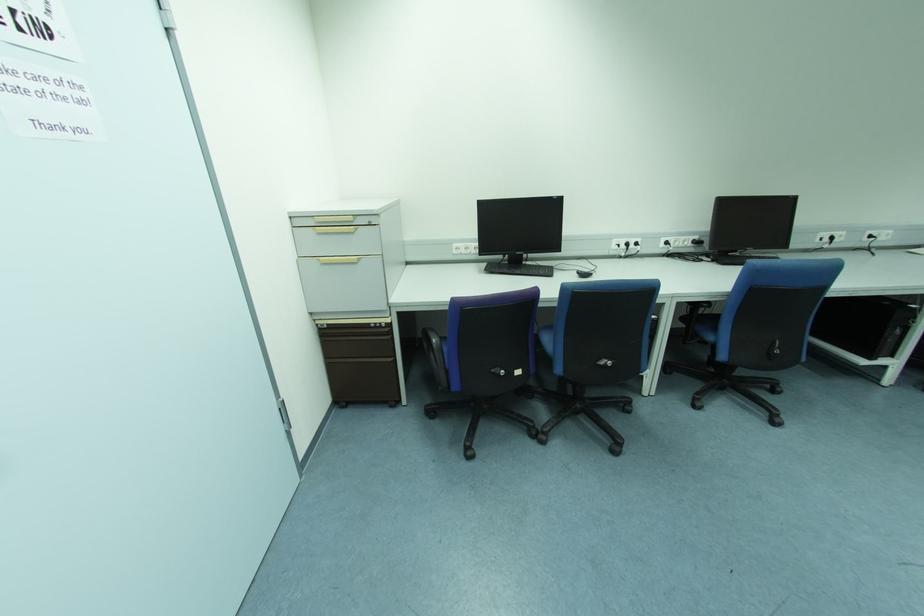
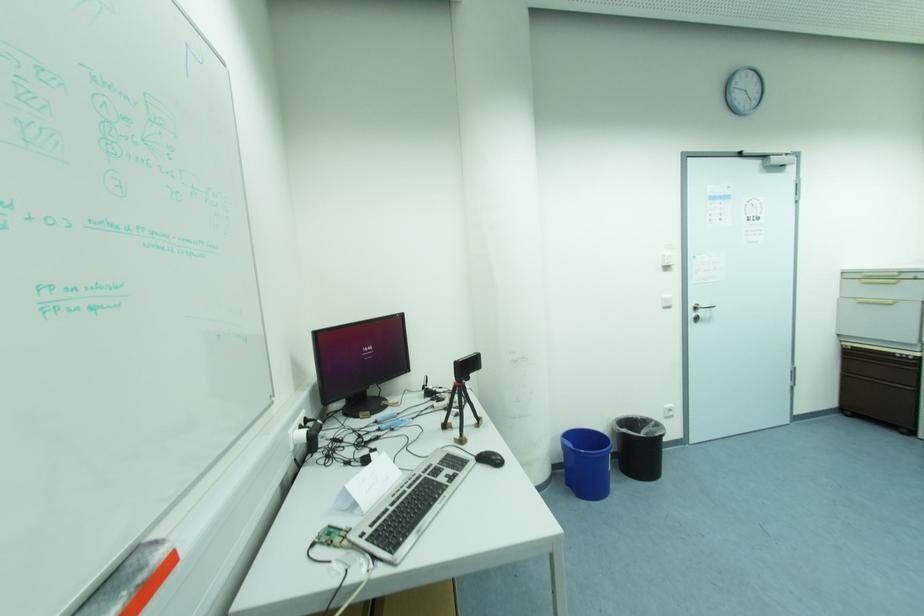
Locate, in the second image, the point that corresponds to the point at 372,326 in the first image.

(898, 355)